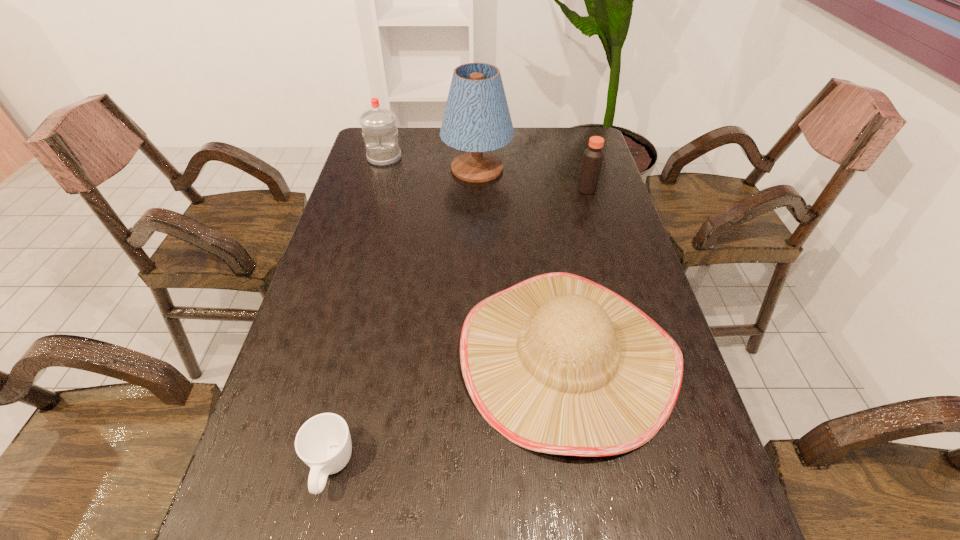
I want to click on empty space that is in between the second tallest object and the sunhat, so click(475, 258).

Identify the location of vacant space that is in between the second tallest object and the sunhat. (475, 258).

Identify which object is the closest to the sunhat. Please provide its 2D coordinates. Your answer should be formatted as a tuple, i.e. [(x, y)], where the tuple contains the x and y coordinates of a point satisfying the conditions above.

[(323, 442)]

The width and height of the screenshot is (960, 540). I want to click on object that is the closest one to the vinegar, so click(x=476, y=119).

At what (x,y) coordinates should I click in order to perform the action: click on free space that satisfies the following two spatial constraints: 1. on the handle side of the water bottle; 2. on the right side of the sunhat. Please return your answer as a coordinate pair (x, y). This screenshot has height=540, width=960. Looking at the image, I should click on (328, 357).